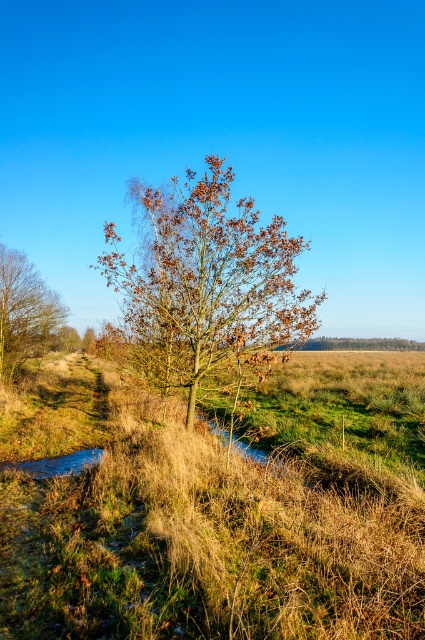
Is brown leafy tree at left shorter than shiny blue puddle at lower left?

In fact, brown leafy tree at left may be taller than shiny blue puddle at lower left.

Which is more to the left, brown leafy tree at left or shiny blue puddle at lower left?

Positioned to the left is brown leafy tree at left.

Which is in front, point (40, 339) or point (95, 461)?

Positioned in front is point (95, 461).

At what (x,y) coordinates should I click in order to perform the action: click on brown leafy tree at left. Please return your answer as a coordinate pair (x, y). Looking at the image, I should click on (25, 310).

Consider the image. Between brown leafy tree at center and brown leafy tree at left, which one has more height?

With more height is brown leafy tree at center.

This screenshot has width=425, height=640. I want to click on brown leafy tree at center, so tap(206, 280).

Find the location of a particular element. Image resolution: width=425 pixels, height=640 pixels. brown leafy tree at center is located at coordinates (206, 280).

You are a GUI agent. You are given a task and a screenshot of the screen. Output one action in this format:
    pyautogui.click(x=<x>, y=<y>)
    Task: Click on the brown leafy tree at center
    This screenshot has width=425, height=640.
    Given the screenshot: What is the action you would take?
    [x=206, y=280]

Consider the image. Between brown leafy tree at center and shiny blue puddle at lower left, which one appears on the right side from the viewer's perspective?

From the viewer's perspective, brown leafy tree at center appears more on the right side.

In the scene shown: Does brown leafy tree at center have a lesser height compared to shiny blue puddle at lower left?

In fact, brown leafy tree at center may be taller than shiny blue puddle at lower left.

The image size is (425, 640). I want to click on brown leafy tree at center, so click(206, 280).

Image resolution: width=425 pixels, height=640 pixels. In order to click on brown leafy tree at center in this screenshot , I will do `click(206, 280)`.